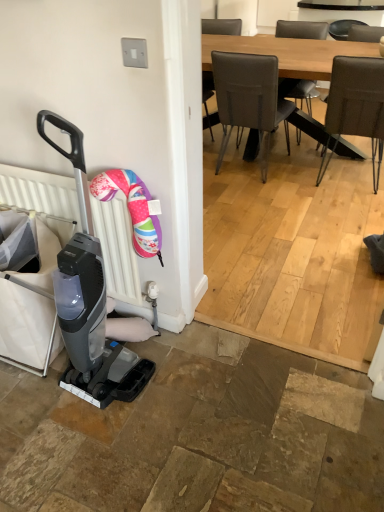
Question: Relative to leather-like brown chair at upper right, is light brown wooden table at upper center in front or behind?

Choices:
 (A) behind
 (B) front

Answer: (A)

Question: Is light brown wooden table at upper center inside the boundaries of leather-like brown chair at upper right, or outside?

Choices:
 (A) outside
 (B) inside

Answer: (A)

Question: Based on their relative distances, which object is farther from the leather-like brown chair at upper right?

Choices:
 (A) white plastic radiator at left
 (B) light brown wooden table at upper center
 (C) matte black baby carriage at left

Answer: (C)

Question: Which object is the farthest from the matte black baby carriage at left?

Choices:
 (A) leather-like brown chair at upper right
 (B) light brown wooden table at upper center
 (C) white plastic radiator at left

Answer: (B)